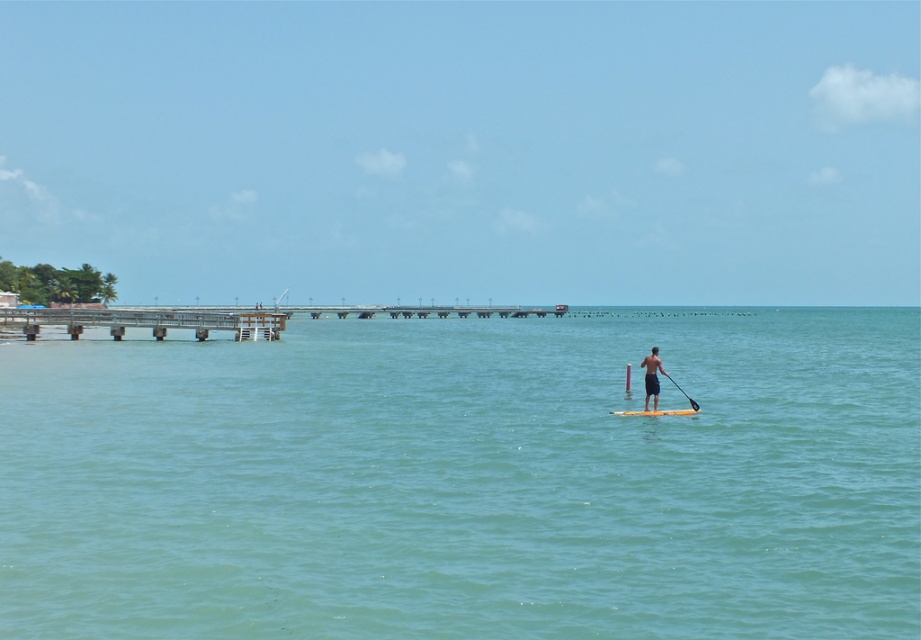
Question: Considering the real-world distances, which object is closest to the brown wooden dock at left?

Choices:
 (A) yellow foam board at center
 (B) black rubber paddle at center

Answer: (A)

Question: Is brown wooden dock at left smaller than black rubber paddle at center?

Choices:
 (A) yes
 (B) no

Answer: (B)

Question: Does yellow foam board at center appear over black rubber paddle at center?

Choices:
 (A) yes
 (B) no

Answer: (B)

Question: Which of the following is the farthest from the observer?

Choices:
 (A) clear blue water at center
 (B) black rubber paddle at center
 (C) yellow foam board at center
 (D) brown wooden dock at left

Answer: (D)

Question: Considering the relative positions of clear blue water at center and yellow foam board at center in the image provided, where is clear blue water at center located with respect to yellow foam board at center?

Choices:
 (A) below
 (B) above

Answer: (B)

Question: Which point is closer to the camera taking this photo?

Choices:
 (A) (815, 557)
 (B) (102, 310)
 (C) (651, 353)

Answer: (A)